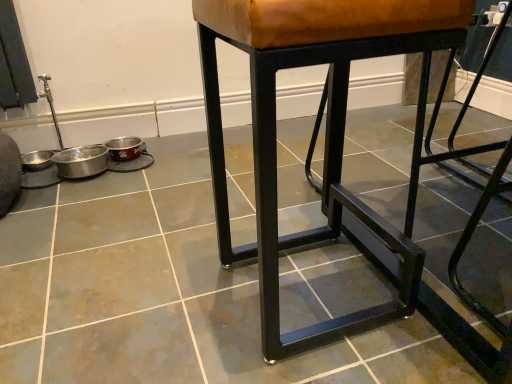
Question: Considering the relative sizes of brown leather stool at center and black metal stool at center in the image provided, is brown leather stool at center shorter than black metal stool at center?

Choices:
 (A) no
 (B) yes

Answer: (A)

Question: Is brown leather stool at center in front of black metal stool at center?

Choices:
 (A) yes
 (B) no

Answer: (B)

Question: Is black metal stool at center at the back of brown leather stool at center?

Choices:
 (A) yes
 (B) no

Answer: (B)

Question: Considering the relative positions of brown leather stool at center and black metal stool at center in the image provided, is brown leather stool at center to the left of black metal stool at center from the viewer's perspective?

Choices:
 (A) no
 (B) yes

Answer: (A)

Question: Is brown leather stool at center wider than black metal stool at center?

Choices:
 (A) no
 (B) yes

Answer: (A)

Question: From the image's perspective, is brown leather stool at center located above black metal stool at center?

Choices:
 (A) no
 (B) yes

Answer: (B)

Question: From the image's perspective, is black metal stool at center on brown leather stool at center?

Choices:
 (A) yes
 (B) no

Answer: (B)

Question: From a real-world perspective, is black metal stool at center on top of brown leather stool at center?

Choices:
 (A) no
 (B) yes

Answer: (A)

Question: Is black metal stool at center behind brown leather stool at center?

Choices:
 (A) yes
 (B) no

Answer: (B)

Question: Can brown leather stool at center be found inside black metal stool at center?

Choices:
 (A) yes
 (B) no

Answer: (B)

Question: Considering the relative positions of black metal stool at center and brown leather stool at center in the image provided, is black metal stool at center to the right of brown leather stool at center from the viewer's perspective?

Choices:
 (A) yes
 (B) no

Answer: (B)

Question: Considering the relative sizes of black metal stool at center and brown leather stool at center in the image provided, is black metal stool at center shorter than brown leather stool at center?

Choices:
 (A) no
 (B) yes

Answer: (B)

Question: Does point (13, 337) appear closer or farther from the camera than point (352, 16)?

Choices:
 (A) farther
 (B) closer

Answer: (A)